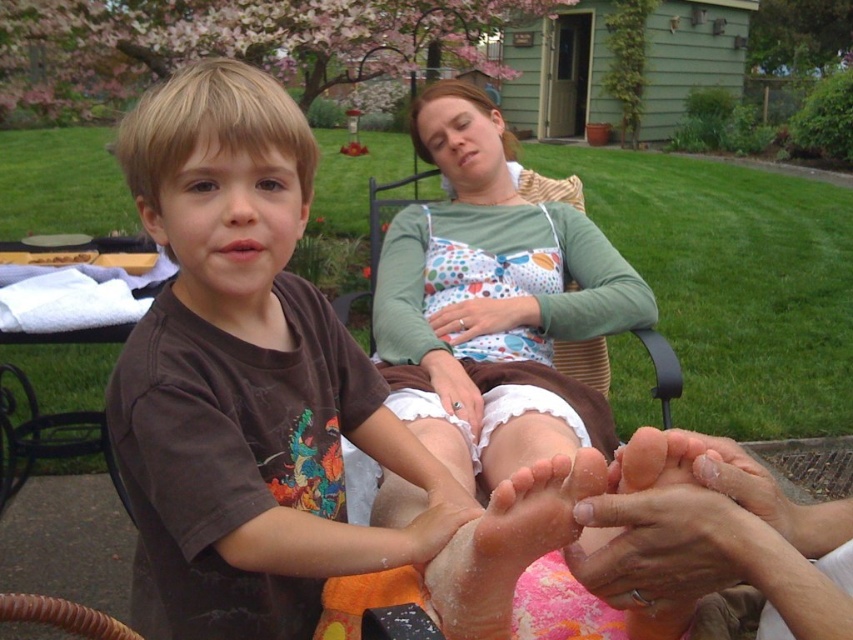
You are a photographer trying to capture a candid shot of the scene. You need to ensure that both the polka dot fabric dress at center and the sandy skin feet at lower center are in focus. Given that your camera has a depth of field that can cover objects within a 30 inch range, will both subjects be in focus?

The polka dot fabric dress at center and sandy skin feet at lower center are 35.44 inches apart from each other. Since the distance exceeds the camera depth of field range of 30 inches, both subjects cannot be in focus simultaneously.

You are a tailor measuring a dress for alterations. You need to ensure there is enough space between the polka dot fabric dress at center and the matte white hand at center to comfortably fit a 8 inch wide measuring tape. Can you fit the tape between them?

The distance between the polka dot fabric dress at center and the matte white hand at center is 10.36 inches, which is wider than the 8 inch measuring tape. Therefore, the tape can fit between them comfortably.